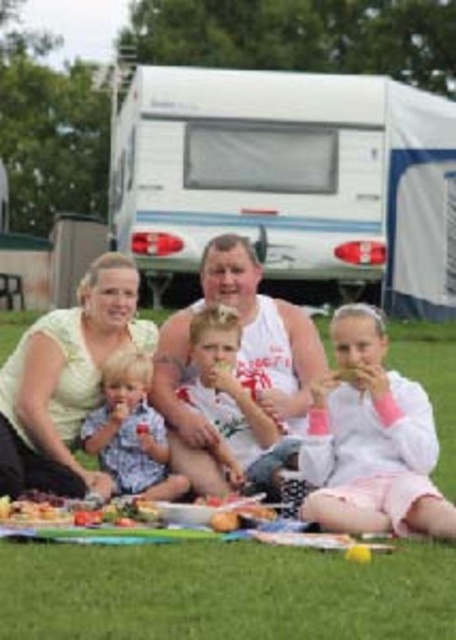
Which is in front, point (263, 317) or point (10, 515)?

Point (10, 515)

Is point (182, 420) less distant than point (13, 512)?

No, (182, 420) is behind (13, 512).

You are a GUI agent. You are given a task and a screenshot of the screen. Output one action in this format:
    pyautogui.click(x=<x>, y=<y>)
    Task: Click on the white cotton tank top at center
    The height and width of the screenshot is (640, 456).
    Given the screenshot: What is the action you would take?
    pyautogui.click(x=241, y=346)

Can you confirm if white cotton shirt at center is bigger than light brown hair at center?

Yes, white cotton shirt at center is bigger than light brown hair at center.

From the picture: Does white cotton shirt at center have a smaller size compared to light brown hair at center?

Incorrect, white cotton shirt at center is not smaller in size than light brown hair at center.

Identify the location of white cotton shirt at center. (372, 440).

Which is more to the left, white plastic recreational vehicle at upper center or white cotton shirt at center?

white plastic recreational vehicle at upper center is more to the left.

Does white plastic recreational vehicle at upper center appear on the left side of white cotton shirt at center?

Indeed, white plastic recreational vehicle at upper center is positioned on the left side of white cotton shirt at center.

This screenshot has width=456, height=640. Identify the location of white plastic recreational vehicle at upper center. 290,179.